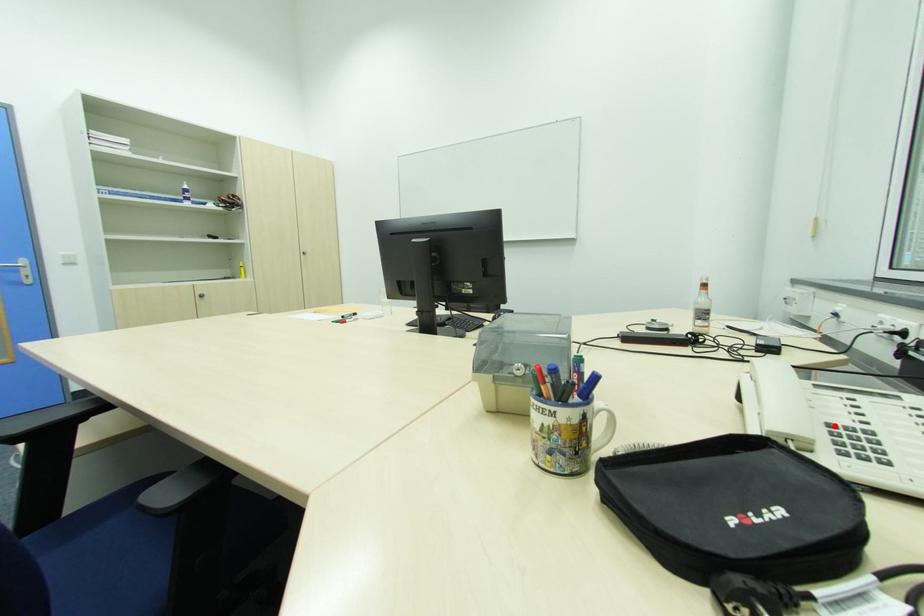
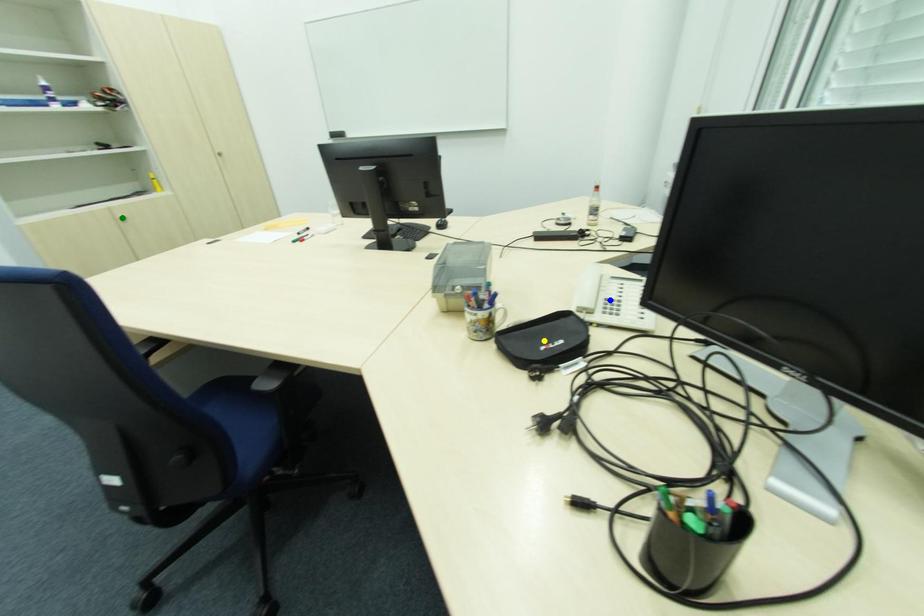
Question: I am providing you with two images of the same scene from different viewpoints. A red point is marked on the first image. You are given multiple points on the second image. Which spot in image 2 lines up with the point in image 1?

Choices:
 (A) yellow point
 (B) green point
 (C) blue point

Answer: (C)